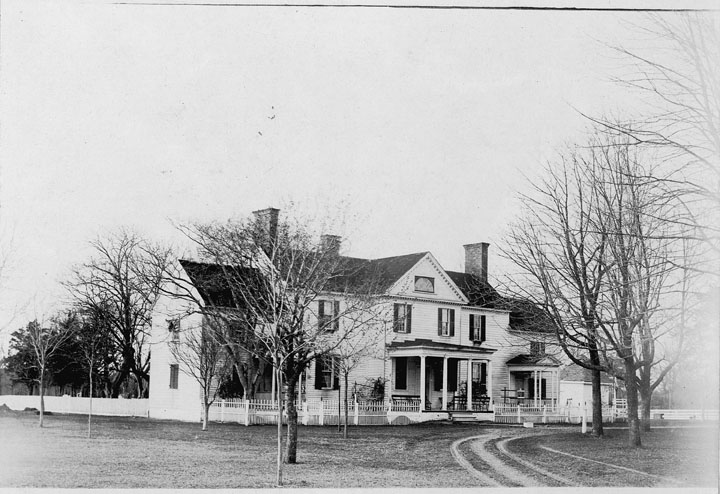
The height and width of the screenshot is (494, 720). Find the location of `chimney`. chimney is located at coordinates (472, 261), (333, 243), (261, 224).